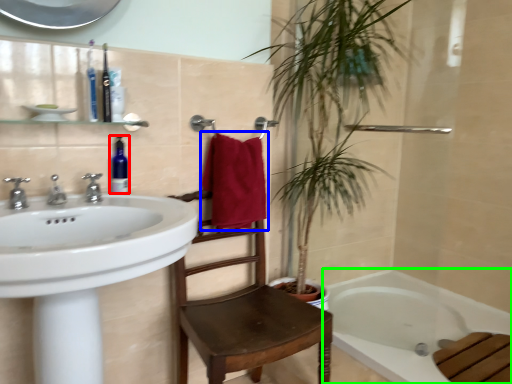
Question: Based on their relative distances, which object is nearer to soap dispenser (highlighted by a red box)? Choose from bath towel (highlighted by a blue box) and bathtub (highlighted by a green box).

Choices:
 (A) bath towel
 (B) bathtub

Answer: (A)